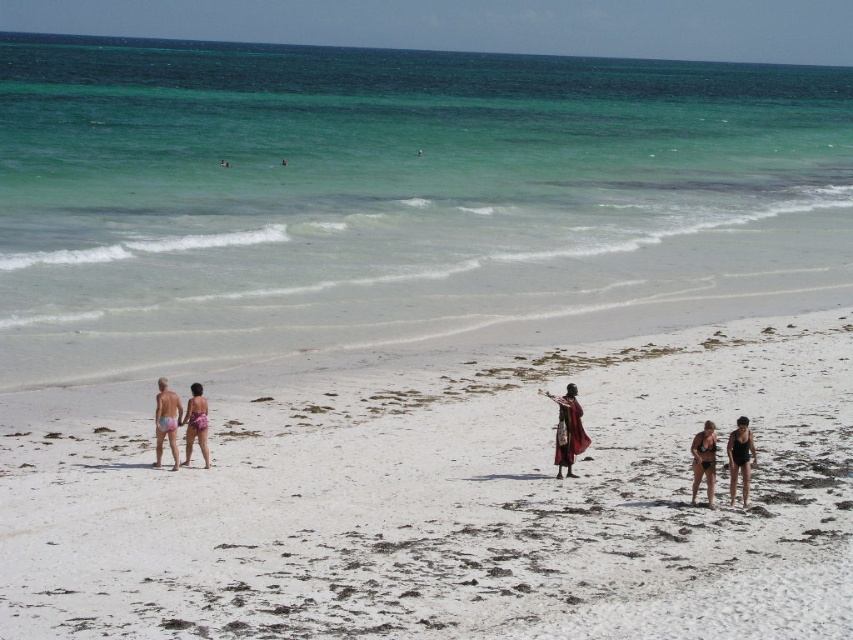
Question: Which of the following is the closest to the observer?

Choices:
 (A) (250, 492)
 (B) (735, 477)

Answer: (A)

Question: Which of these objects is positioned closest to the pink fabric shorts at left?

Choices:
 (A) red fabric person at center
 (B) matte black bikini at lower right

Answer: (A)

Question: Is the position of clear water at beach center less distant than that of pink fabric bikini at lower left?

Choices:
 (A) yes
 (B) no

Answer: (B)

Question: Which of the following is the farthest from the observer?

Choices:
 (A) black swimsuit at lower right
 (B) pink fabric bikini at lower left
 (C) pink fabric shorts at left

Answer: (B)

Question: Does red fabric person at center appear on the left side of matte black bikini at lower right?

Choices:
 (A) no
 (B) yes

Answer: (B)

Question: Does clear water at beach center appear under pink fabric shorts at left?

Choices:
 (A) yes
 (B) no

Answer: (B)